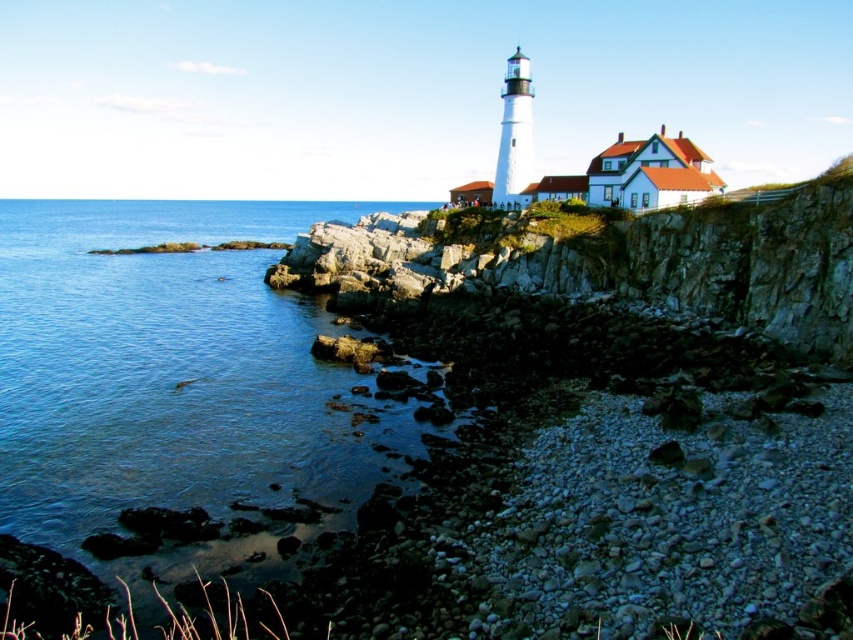
You are a boat captain navigating near the coast. You see the point at coordinates (177,390) in the image. Is this point located on the rocky shoreline or in the blue water?

The point at coordinates (177,390) is located on the blue water at lower left, so it is in the blue water.

You are a photographer planning to capture the entire scene in one shot. Given that your camera can only focus on objects within a 10m width, will the blue water at lower left and the rocky cliff at upper center both fit within the frame?

The blue water at lower left might be wider than rocky cliff at upper center, so it is possible that the total width required to include both could exceed the camera frame limit. However, without exact measurements, it is uncertain. You might need to adjust your position or equipment.

You are standing at the center of the rocky shoreline in the coastal scene. You want to reach the blue water at lower left. Which direction should you walk to get there?

You should walk towards the lower left direction to reach the blue water at lower left since it is located at point (177, 390).